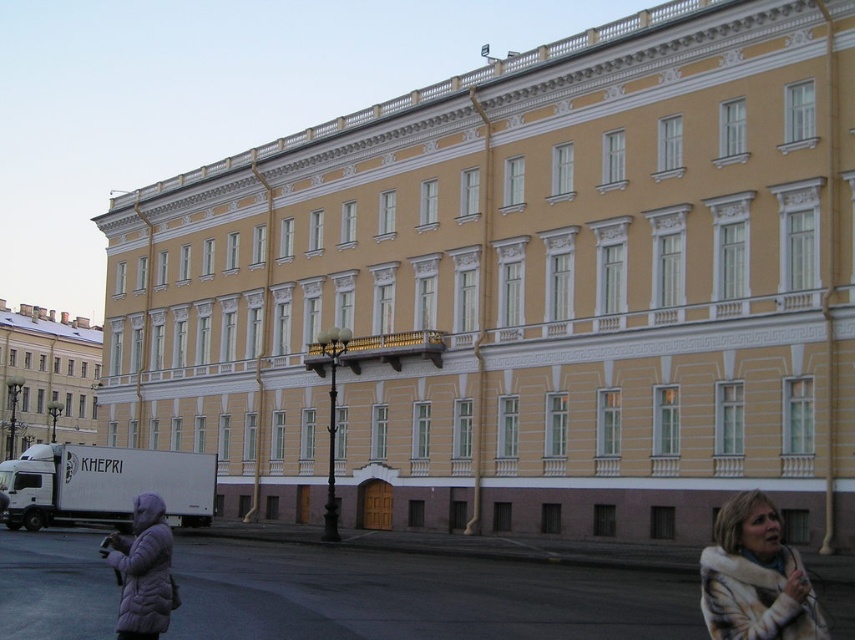
Question: Among these objects, which one is farthest from the camera?

Choices:
 (A) fur coat at lower right
 (B) purple fuzzy coat at lower left
 (C) yellow painted building at upper left

Answer: (C)

Question: Which object appears closest to the camera in this image?

Choices:
 (A) purple fuzzy coat at lower left
 (B) fur coat at lower right
 (C) yellow painted building at upper left

Answer: (B)

Question: Which object appears closest to the camera in this image?

Choices:
 (A) purple fuzzy coat at lower left
 (B) yellow painted building at upper left

Answer: (A)

Question: Does fur coat at lower right have a larger size compared to purple fuzzy coat at lower left?

Choices:
 (A) no
 (B) yes

Answer: (A)

Question: Is fur coat at lower right to the right of yellow painted building at upper left from the viewer's perspective?

Choices:
 (A) yes
 (B) no

Answer: (A)

Question: Can you confirm if yellow painted building at upper left is bigger than purple fuzzy coat at lower left?

Choices:
 (A) no
 (B) yes

Answer: (B)